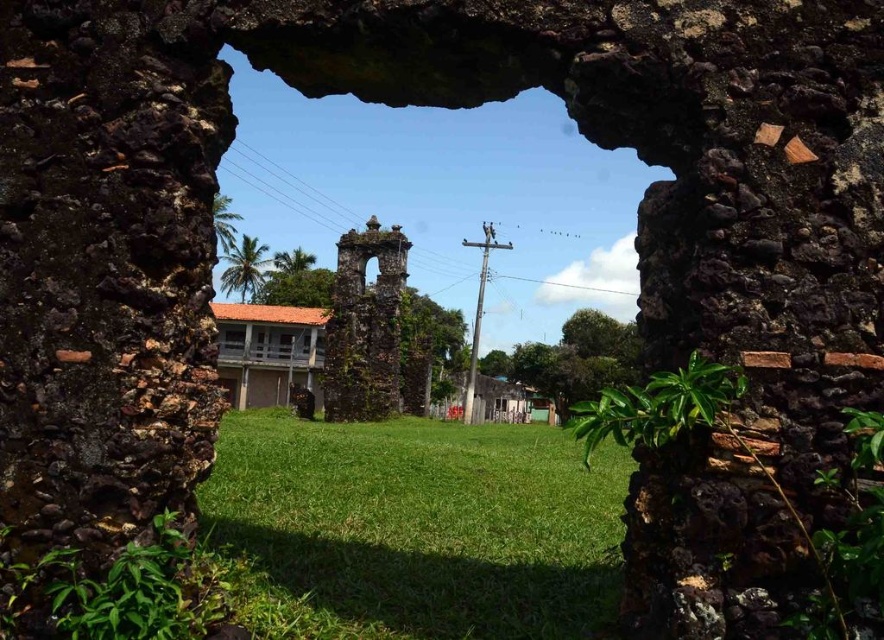
Between clear glass window at center and transparent glass window at center, which one has more height?

clear glass window at center is taller.

Is clear glass window at center above transparent glass window at center?

No.

Does point (240, 336) lie in front of point (288, 346)?

No, (240, 336) is behind (288, 346).

Where is `clear glass window at center`? clear glass window at center is located at coordinates (234, 339).

Does rusty stone arch at center appear on the right side of transparent glass window at center?

Yes, rusty stone arch at center is to the right of transparent glass window at center.

Describe the element at coordinates (364, 324) in the screenshot. I see `rusty stone arch at center` at that location.

This screenshot has height=640, width=884. What are the coordinates of `rusty stone arch at center` in the screenshot? It's located at (364, 324).

Does green grassy at center have a smaller size compared to clear glass window at center?

Incorrect, green grassy at center is not smaller in size than clear glass window at center.

The width and height of the screenshot is (884, 640). I want to click on green grassy at center, so click(423, 524).

Does point (265, 426) come closer to viewer compared to point (223, 339)?

Yes, it is in front of point (223, 339).

Find the location of a particular element. green grassy at center is located at coordinates (423, 524).